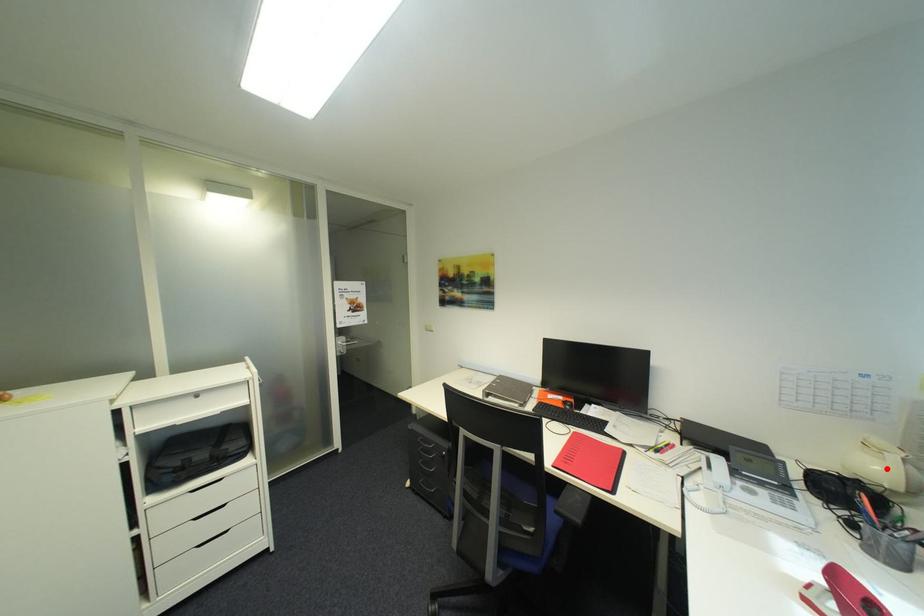
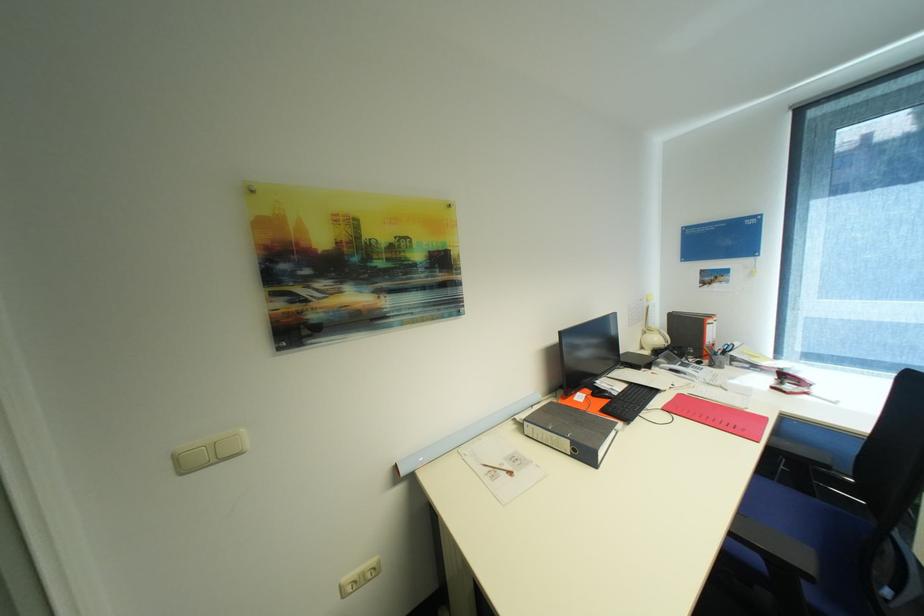
The point at the highlighted location is marked in the first image. Where is the corresponding point in the second image?

(663, 339)